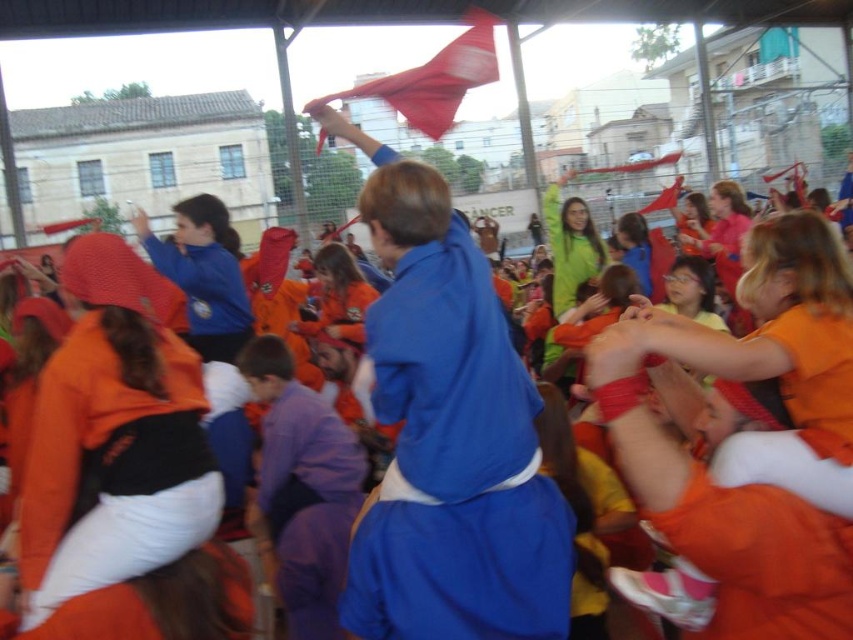
Can you confirm if blue cotton robe at center is smaller than orange fleece robe at lower left?

Incorrect, blue cotton robe at center is not smaller in size than orange fleece robe at lower left.

Where is `blue cotton robe at center`? This screenshot has width=853, height=640. blue cotton robe at center is located at coordinates (456, 467).

Can you confirm if blue cotton robe at center is wider than silky red flag at upper center?

In fact, blue cotton robe at center might be narrower than silky red flag at upper center.

Does blue cotton robe at center have a lesser height compared to silky red flag at upper center?

Yes.

What are the coordinates of `blue cotton robe at center` in the screenshot? It's located at (456, 467).

Who is positioned more to the left, blue cotton robe at center or red fabric flag at upper center?

blue cotton robe at center

Can you confirm if blue cotton robe at center is shorter than red fabric flag at upper center?

Incorrect, blue cotton robe at center's height does not fall short of red fabric flag at upper center's.

Does point (550, 536) lie in front of point (676, 193)?

Yes, point (550, 536) is in front of point (676, 193).

This screenshot has width=853, height=640. Identify the location of blue cotton robe at center. (456, 467).